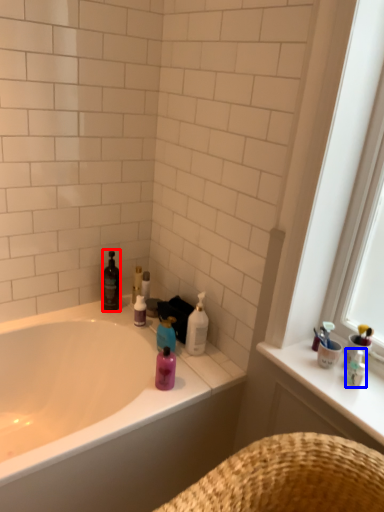
Question: Which of the following is the farthest to the observer, cleaning product (highlighted by a red box) or toiletry (highlighted by a blue box)?

Choices:
 (A) cleaning product
 (B) toiletry

Answer: (A)